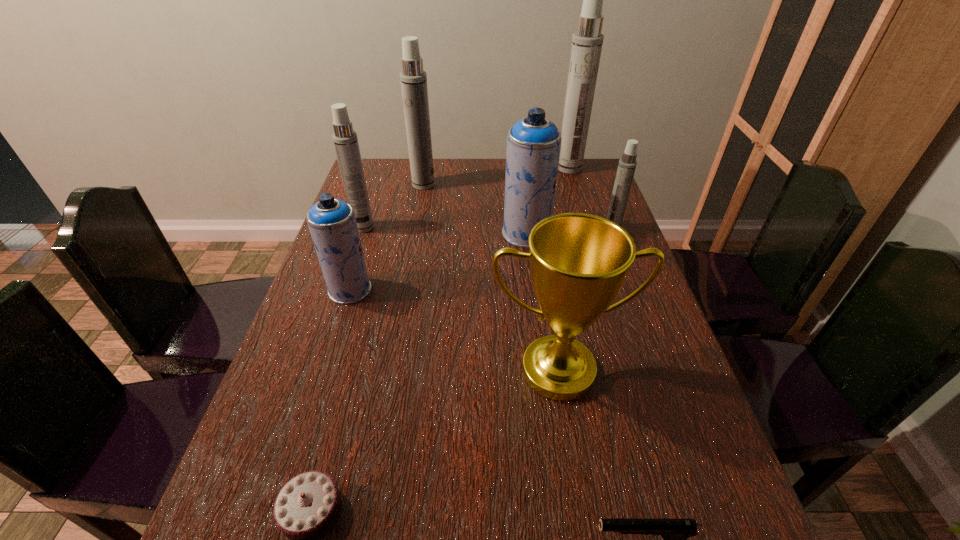
This screenshot has width=960, height=540. Identify the location of vacant area between the rightmost object and the nearer blue aerosol can. (481, 259).

Point out which object is positioned as the third nearest to the smallest white aerosol can. Please provide its 2D coordinates. Your answer should be formatted as a tuple, i.e. [(x, y)], where the tuple contains the x and y coordinates of a point satisfying the conditions above.

[(578, 262)]

This screenshot has width=960, height=540. Identify the location of the sixth closest object relative to the bigger blue aerosol can. (345, 139).

Identify which aerosol can is the fifth nearest to the pistol. Please provide its 2D coordinates. Your answer should be formatted as a tuple, i.e. [(x, y)], where the tuple contains the x and y coordinates of a point satisfying the conditions above.

[(413, 78)]

Where is `aerosol can that is the fourth closest to the fifth shortest aerosol can`? This screenshot has width=960, height=540. aerosol can that is the fourth closest to the fifth shortest aerosol can is located at coordinates (587, 41).

Select which white aerosol can is the third closest to the chocolate chocolate cake. Please provide its 2D coordinates. Your answer should be formatted as a tuple, i.e. [(x, y)], where the tuple contains the x and y coordinates of a point satisfying the conditions above.

[(413, 78)]

This screenshot has width=960, height=540. In order to click on white aerosol can that is the closest to the rightmost white aerosol can in this screenshot , I will do `click(587, 41)`.

This screenshot has width=960, height=540. Find the location of `free location that satisfies the following two spatial constraints: 1. on the back side of the farthest object; 2. on the left side of the farther blue aerosol can`. free location that satisfies the following two spatial constraints: 1. on the back side of the farthest object; 2. on the left side of the farther blue aerosol can is located at coordinates (517, 168).

The height and width of the screenshot is (540, 960). In order to click on vacant space that satisfies the following two spatial constraints: 1. on the front side of the second aerosol can from right to left; 2. on the left side of the smallest white aerosol can in this screenshot , I will do `click(588, 228)`.